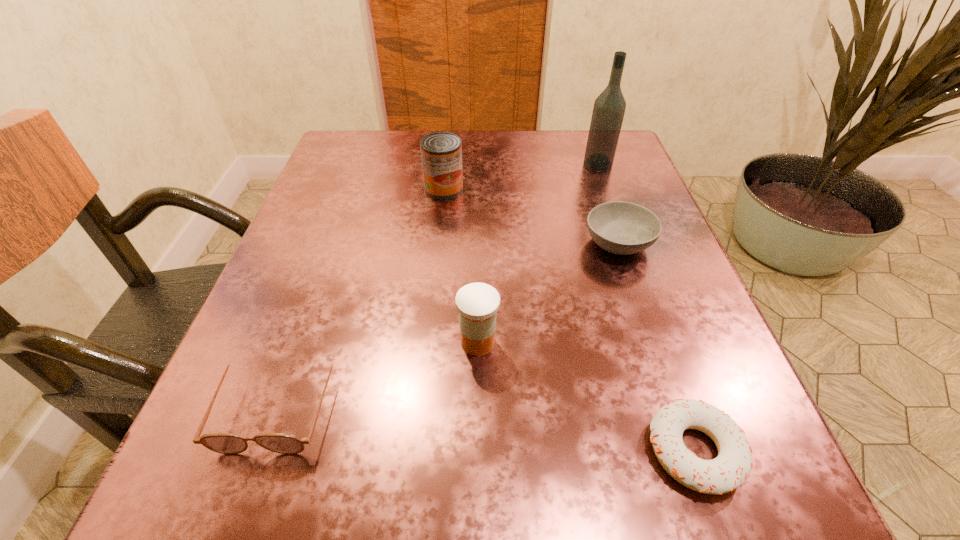
You are a GUI agent. You are given a task and a screenshot of the screen. Output one action in this format:
    pyautogui.click(x=<x>, y=<y>)
    Task: Click on the vodka
    The height and width of the screenshot is (540, 960).
    Given the screenshot: What is the action you would take?
    pyautogui.click(x=609, y=108)

Locate an element on the screen. The width and height of the screenshot is (960, 540). the farthest object is located at coordinates click(609, 108).

Locate an element on the screen. Image resolution: width=960 pixels, height=540 pixels. can is located at coordinates (441, 152).

Where is `the fifth object from right to left`? This screenshot has width=960, height=540. the fifth object from right to left is located at coordinates (441, 152).

Where is `medicine`? The image size is (960, 540). medicine is located at coordinates (477, 303).

Locate an element on the screen. The height and width of the screenshot is (540, 960). bowl is located at coordinates (619, 227).

The image size is (960, 540). I want to click on the leftmost object, so click(224, 443).

This screenshot has width=960, height=540. In order to click on doughnut in this screenshot , I will do `click(731, 468)`.

At what (x,y) coordinates should I click in order to perform the action: click on free region located 0.370m on the front of the farthest object. Please return your answer as a coordinate pair (x, y). The height and width of the screenshot is (540, 960). Looking at the image, I should click on (x=644, y=295).

Where is `free space located on the front of the can`? This screenshot has width=960, height=540. free space located on the front of the can is located at coordinates (440, 227).